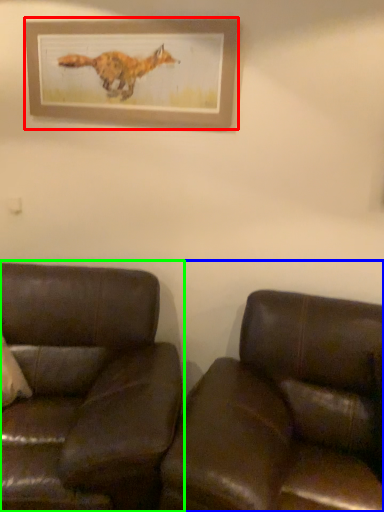
Question: Which object is the closest to the picture frame (highlighted by a red box)? Choose among these: studio couch (highlighted by a blue box) or studio couch (highlighted by a green box).

Choices:
 (A) studio couch
 (B) studio couch

Answer: (B)